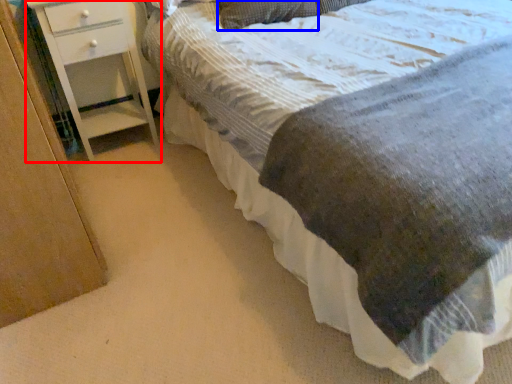
Question: Which of the following is the farthest to the observer, chest of drawers (highlighted by a red box) or pillow (highlighted by a blue box)?

Choices:
 (A) chest of drawers
 (B) pillow

Answer: (B)